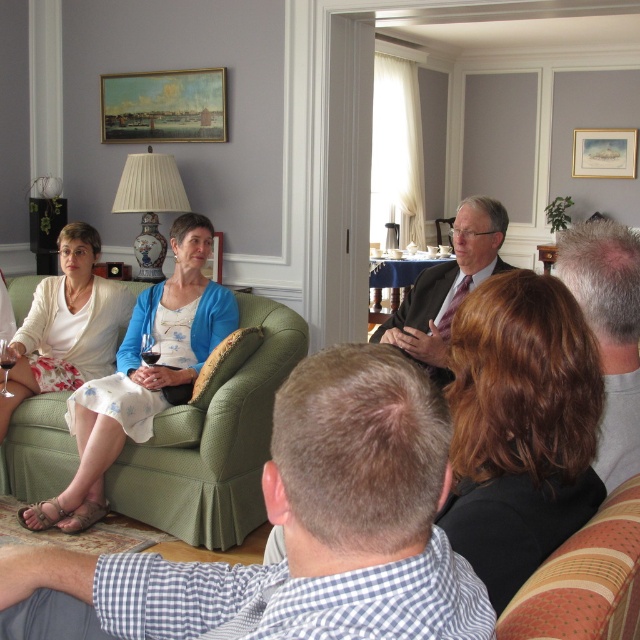
Is brown hair at center shorter than matte green couch at center?

Yes.

Which is in front, point (465, 356) or point (550, 284)?

Point (550, 284)

Where is `brown hair at center`? brown hair at center is located at coordinates (520, 428).

Find the location of a particular element. Image resolution: width=640 pixels, height=640 pixels. brown hair at center is located at coordinates (520, 428).

Between matte white dress at center and matte white blouse at center, which one appears on the left side from the viewer's perspective?

matte white blouse at center

Does matte white dress at center have a greater height compared to matte white blouse at center?

Indeed, matte white dress at center has a greater height compared to matte white blouse at center.

Is point (112, 412) positioned after point (61, 317)?

No, it is in front of (61, 317).

Locate an element on the screen. matte white dress at center is located at coordinates (141, 374).

Is brown hair at center wider than matte white blouse at center?

Incorrect, brown hair at center's width does not surpass matte white blouse at center's.

Does brown hair at center have a larger size compared to matte white blouse at center?

No.

At what (x,y) coordinates should I click in order to perform the action: click on brown hair at center. Please return your answer as a coordinate pair (x, y). Looking at the image, I should click on (520, 428).